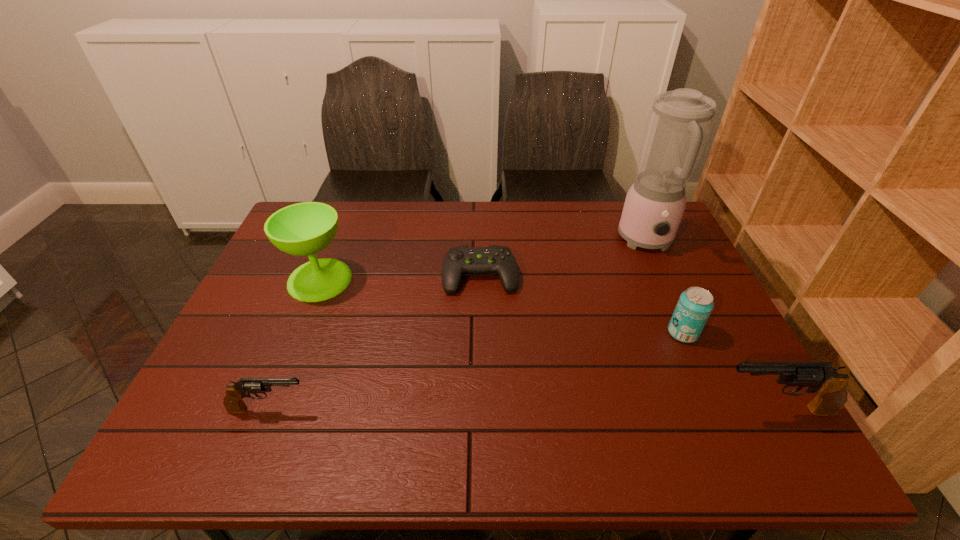
I want to click on gun present at the right edge, so click(x=831, y=386).

Find the location of a particular element. The height and width of the screenshot is (540, 960). food processor located at the right edge is located at coordinates (679, 122).

The image size is (960, 540). What are the coordinates of `beer can that is at the right edge` in the screenshot? It's located at coord(695,305).

Find the location of a particular element. object located in the near left corner section of the desktop is located at coordinates (233, 402).

This screenshot has width=960, height=540. In order to click on object located at the far right corner in this screenshot , I will do `click(679, 122)`.

The height and width of the screenshot is (540, 960). In order to click on object that is at the near right corner in this screenshot , I will do `click(831, 386)`.

What are the coordinates of `vacant area at the far edge` in the screenshot? It's located at (476, 241).

This screenshot has width=960, height=540. Find the location of `free point at the near edge`. free point at the near edge is located at coordinates (453, 399).

In the image, there is a desktop. At what (x,y) coordinates should I click in order to perform the action: click on blank space at the left edge. Please return your answer as a coordinate pair (x, y). The width and height of the screenshot is (960, 540). Looking at the image, I should click on (272, 288).

I want to click on vacant space at the right edge of the desktop, so click(x=664, y=309).